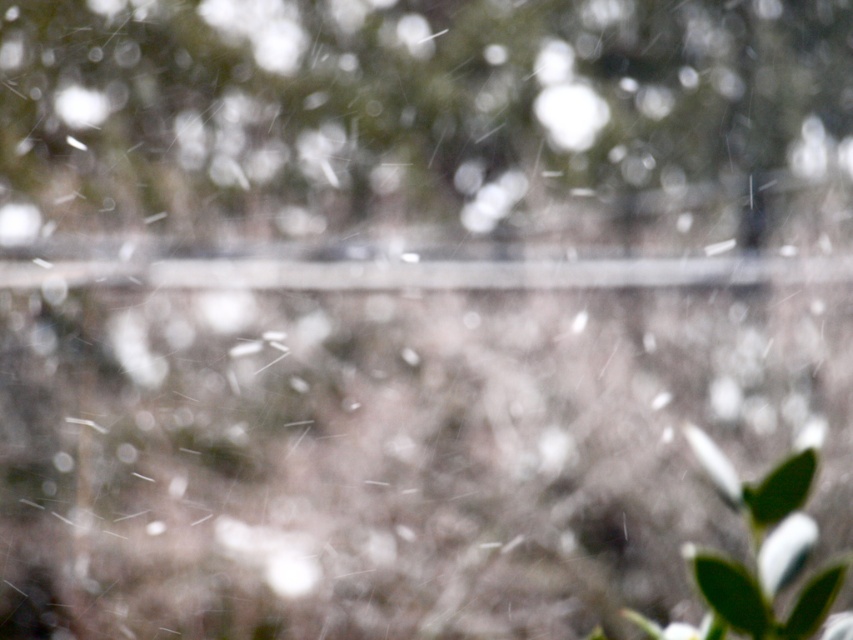
You are a photographer trying to capture the snowflakes in the foreground. You want to ensure both the green leafy tree at center and the green matte leaf at lower right are in focus. Given the shallow depth of field, will both objects be in focus?

The green leafy tree at center is much taller than the green matte leaf at lower right, so they are at different distances from the camera. With a shallow depth of field, it is unlikely both will be in focus simultaneously.

You are an artist trying to paint the snow scene. You want to ensure the green matte leaf at lower right and the green leafy tree at center are positioned correctly according to their depth. Which object should appear closer to you in your painting?

The green leafy tree at center should appear closer because the green matte leaf at lower right is behind it.

In the scene shown: You are standing in the snowfall scene and want to reach both points mentioned. Which point is closer to you, point (596, 102) or point (770, 588)?

Point (596, 102) is closer to you because it is further to the viewer than point (770, 588).